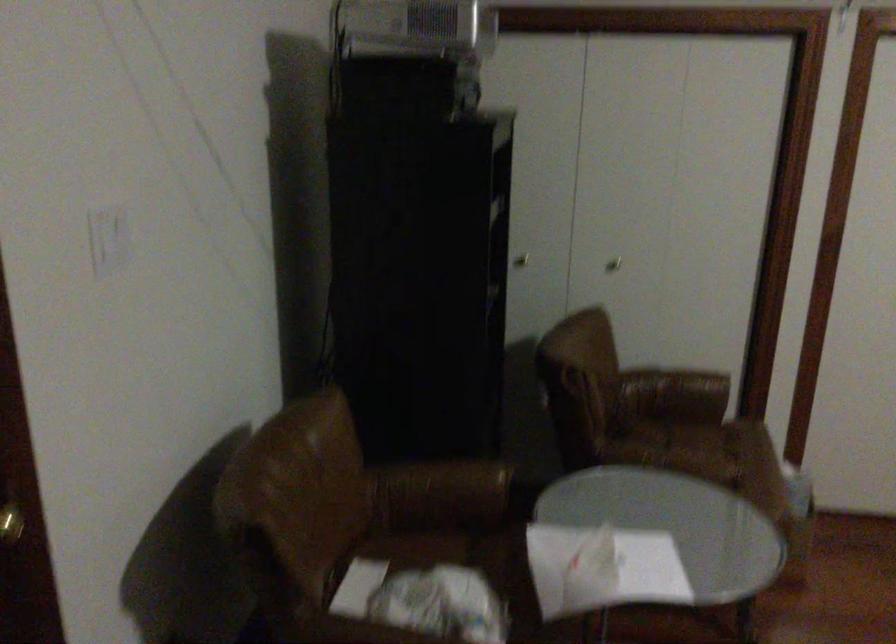
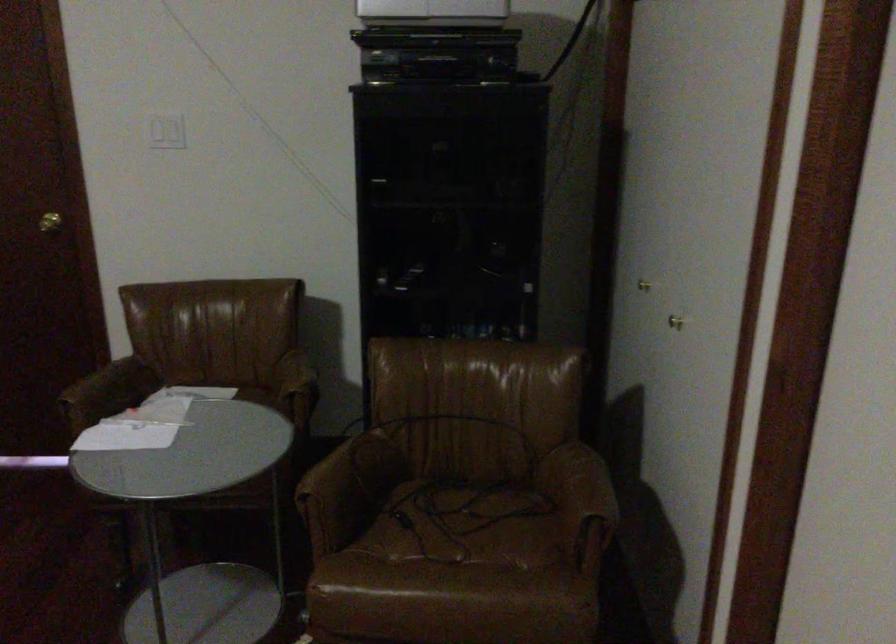
Find the pixel in the second image that matches [688,375] in the first image.

(582, 485)